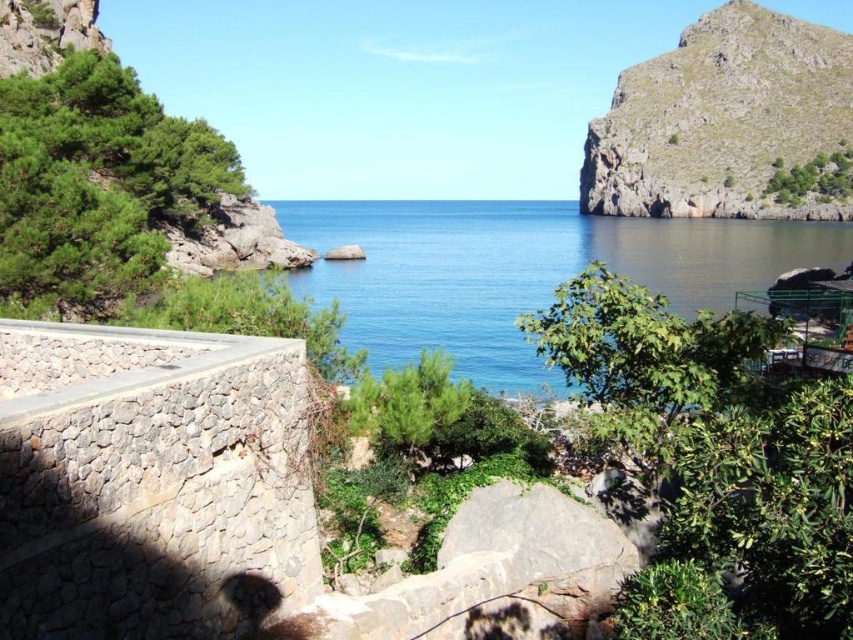
Who is more forward, (486, 320) or (344, 244)?

Point (486, 320) is in front.

Can you confirm if blue water at center is positioned below smooth gray rock at center?

Actually, blue water at center is above smooth gray rock at center.

Is point (300, 224) closer to viewer compared to point (331, 256)?

No, it is behind (331, 256).

Find the location of a particular element. This screenshot has width=853, height=640. blue water at center is located at coordinates tap(521, 272).

How distant is blue water at center from rugged rock cliff at upper right?

blue water at center is 68.63 meters from rugged rock cliff at upper right.

Which is in front, point (757, 285) or point (804, 152)?

Point (757, 285) is more forward.

Find the location of `blue water at center`. blue water at center is located at coordinates (521, 272).

Does rugged rock cliff at upper right come behind smooth gray rock at center?

Yes, it is.

In the scene shown: Which is more to the left, rugged rock cliff at upper right or smooth gray rock at center?

From the viewer's perspective, smooth gray rock at center appears more on the left side.

Where is `rugged rock cliff at upper right`? rugged rock cliff at upper right is located at coordinates (729, 124).

Identify the location of rugged rock cliff at upper right. (729, 124).